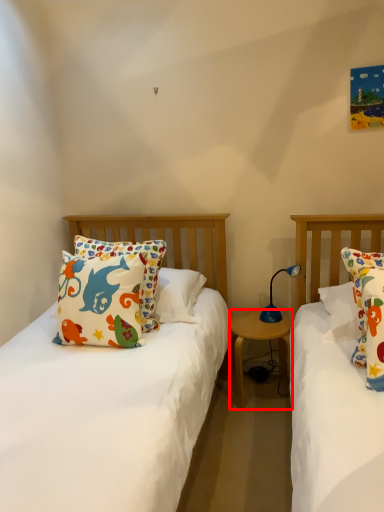
Question: Observing the image, what is the correct spatial positioning of nightstand (annotated by the red box) in reference to lamp?

Choices:
 (A) left
 (B) right

Answer: (A)